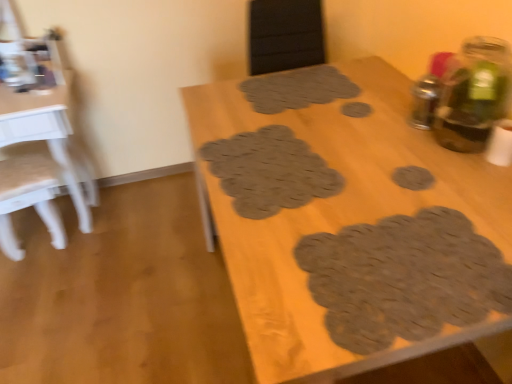
Identify the location of vacant space positioned to the left of brown textured coaster at center-right, positioned as the 4th footprint in top-to-bottom order. The width and height of the screenshot is (512, 384). (353, 191).